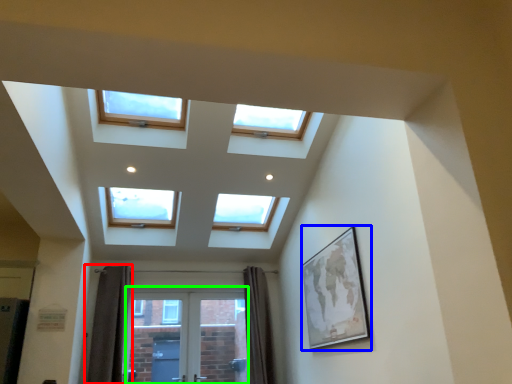
Question: Considering the real-world distances, which object is closest to curtain (highlighted by a red box)? picture frame (highlighted by a blue box) or screen door (highlighted by a green box).

Choices:
 (A) picture frame
 (B) screen door

Answer: (B)